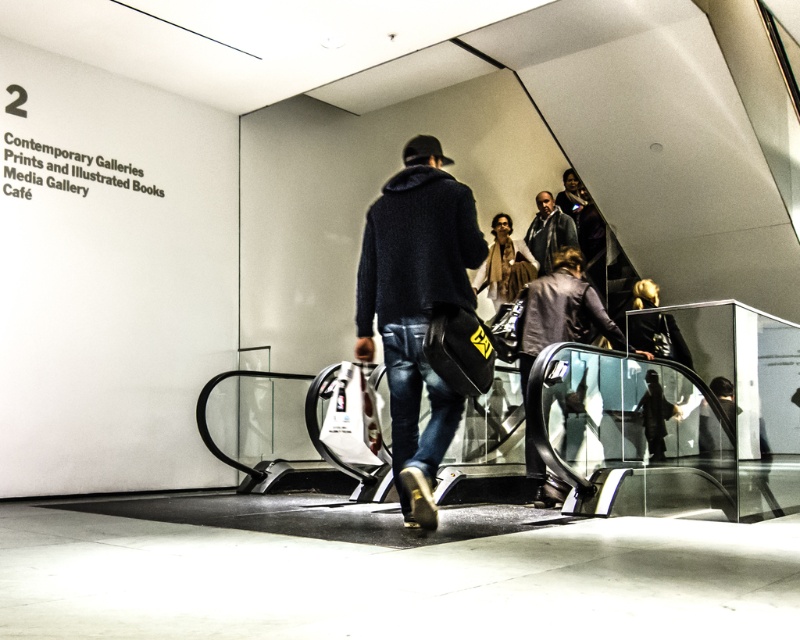
You are an assistant helping a customer who wants to know which clothing item is narrower between the dark blue sweater at center and the dark brown leather jacket at upper center. Based on the scene, can you tell them?

The dark blue sweater at center is narrower than the dark brown leather jacket at upper center.

You are standing in the Contemporary Galleries and want to ask someone about the Media Gallery. You see a person with a brown scarf at center and a dark gray hoodie at upper center. Which one is closer to you?

The brown scarf at center is closer to you since it is 29.88 centimeters from the dark gray hoodie at upper center, indicating it is nearer in the scene.